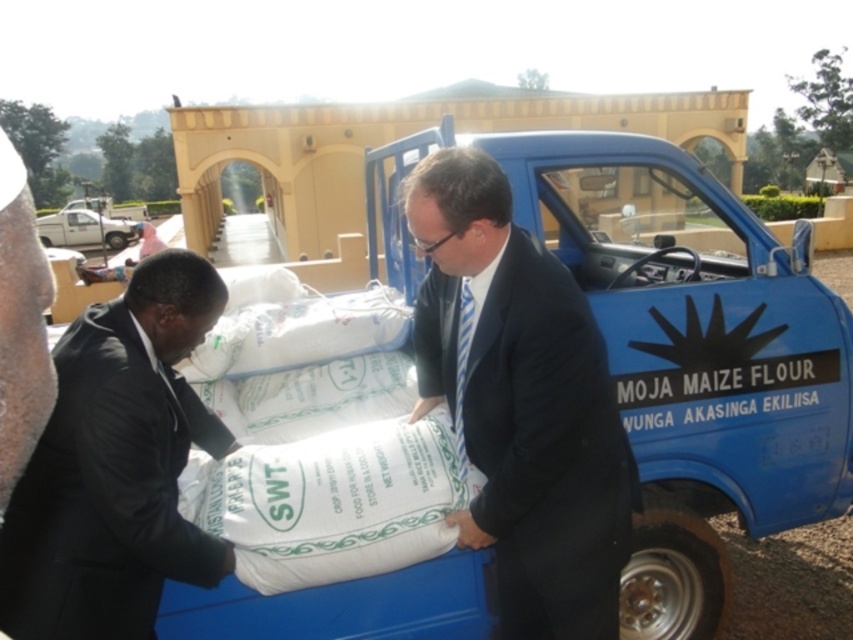
You are a delivery person who needs to determine if the white matte sack at center can fit into a storage box designed for items the size of the dark brown leather jacket at left. Based on the scene description, will the sack fit?

The white matte sack at center is larger in size than the dark brown leather jacket at left, so it will not fit into the storage box designed for the jacket.

What is the spatial relationship between the black matte suit at left and the blue vehicle in the scene?

The black matte suit at left is positioned at coordinates point [115,467], which places it near the left side of the image, likely indicating it is close to the blue vehicle involved in the unloading activity.